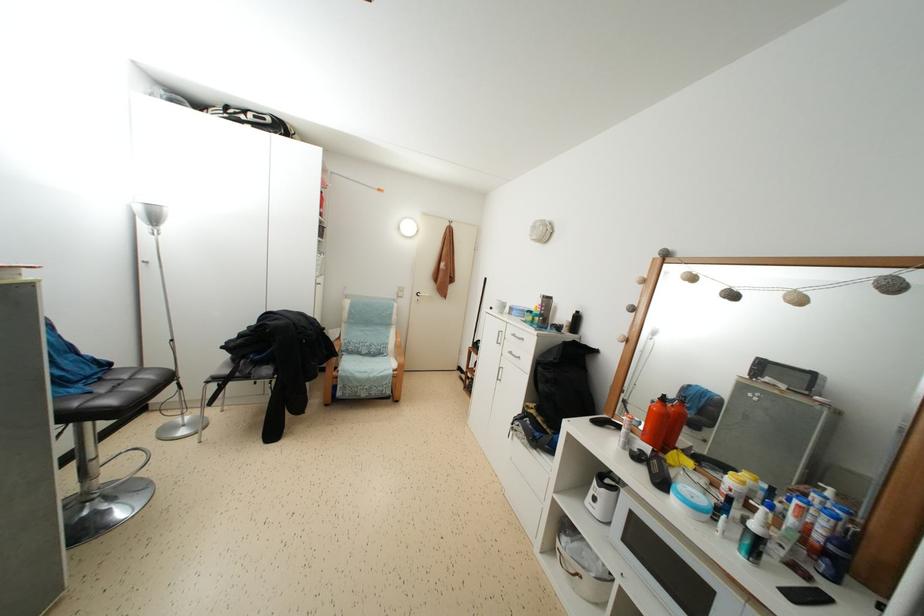
Locate an element on the screen. This screenshot has width=924, height=616. silver drawer handle is located at coordinates (515, 334).